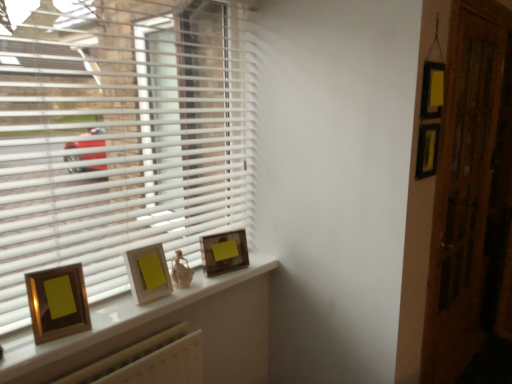
This screenshot has height=384, width=512. What are the coordinates of `vacant area located to the right-hand side of wooden glossy picture frame at left, which is the 3th picture frame from right to left` in the screenshot? It's located at (108, 325).